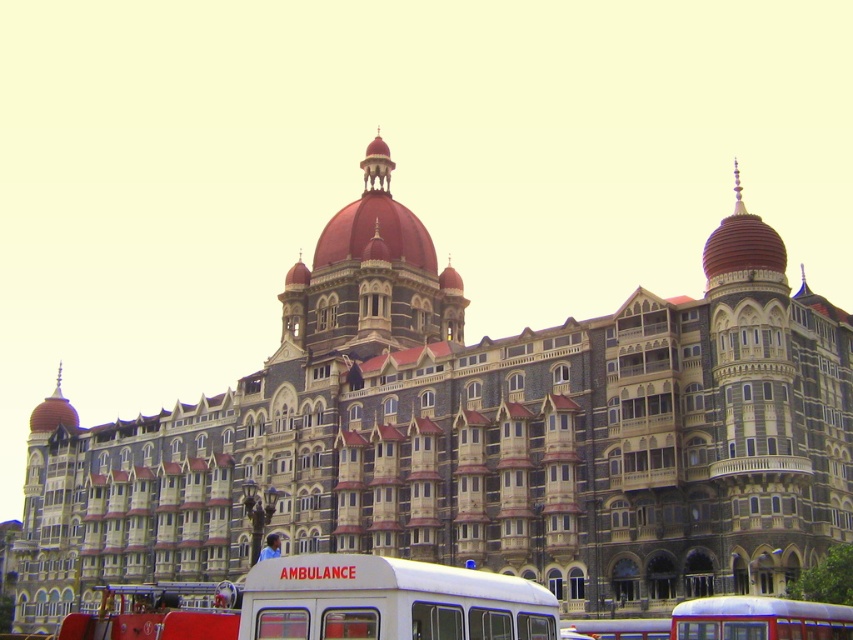
You are a pedestrian standing at the entrance of the grand building. You need to cross the street to reach the blue metallic bus at lower right. However, there is a white matte ambulance at lower center blocking your path. Can you walk around the ambulance to reach the bus?

The white matte ambulance at lower center is taller than the blue metallic bus at lower right, so it is possible to walk around the ambulance to reach the bus since the ambulance is taller but not necessarily wider. However, you should check the actual width of the ambulance before proceeding.

You are a pedestrian standing at the entrance of the grand building. You see a white matte ambulance at lower center and a blue metallic bus at lower right. Which vehicle is closer to your right side?

The blue metallic bus at lower right is closer to your right side because it is positioned to the right of the white matte ambulance at lower center.

You are standing in front of the grand building and want to take a photo. You notice two points on the building marked as point 1 at coordinates point (822, 634) and point 2 at coordinates point (666, 624). Which point is closer to your camera when taking the photo?

Point (822, 634) is closer to the camera than point (666, 624).